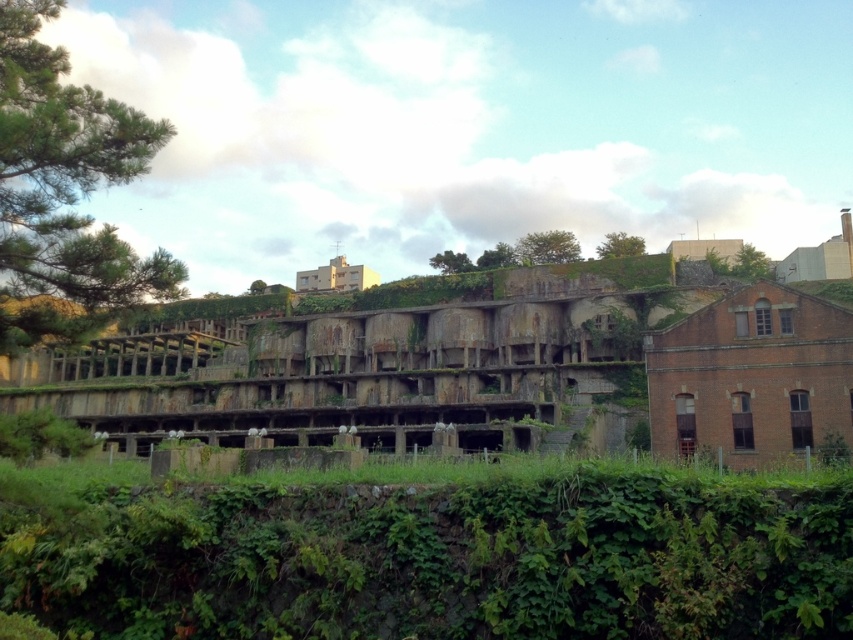
Does green leafy vegetation at center appear on the left side of green leafy tree at left?

In fact, green leafy vegetation at center is to the right of green leafy tree at left.

Can you confirm if green leafy vegetation at center is taller than green leafy tree at left?

Incorrect, green leafy vegetation at center's height is not larger of green leafy tree at left's.

The height and width of the screenshot is (640, 853). What do you see at coordinates (451, 561) in the screenshot?
I see `green leafy vegetation at center` at bounding box center [451, 561].

Where is `green leafy vegetation at center`? This screenshot has width=853, height=640. green leafy vegetation at center is located at coordinates (451, 561).

What do you see at coordinates (451, 561) in the screenshot?
I see `green leafy vegetation at center` at bounding box center [451, 561].

Identify the location of green leafy vegetation at center. This screenshot has width=853, height=640. (451, 561).

At what (x,y) coordinates should I click in order to perform the action: click on green leafy vegetation at center. Please return your answer as a coordinate pair (x, y). Image resolution: width=853 pixels, height=640 pixels. Looking at the image, I should click on (451, 561).

In the scene shown: Can you confirm if rusty concrete ruins at center is positioned below green leafy vegetation at upper center?

Indeed, rusty concrete ruins at center is positioned under green leafy vegetation at upper center.

Which is in front, point (763, 292) or point (599, 252)?

Point (763, 292) is more forward.

Find the location of a particular element. rusty concrete ruins at center is located at coordinates (486, 372).